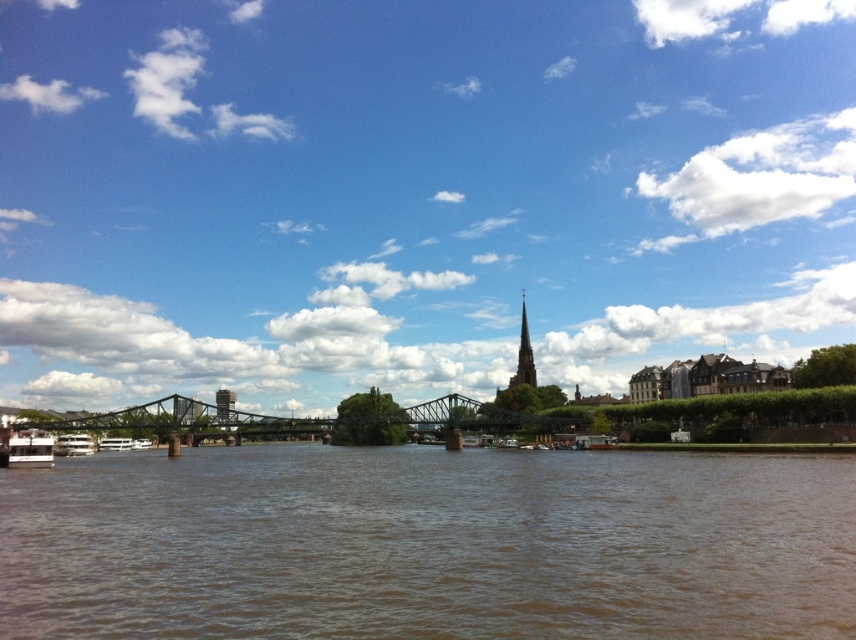
Does blue sky at upper center have a greater height compared to white glossy boat at lower left?

Correct, blue sky at upper center is much taller as white glossy boat at lower left.

Measure the distance between blue sky at upper center and camera.

blue sky at upper center is 466.92 feet away from camera.

Does point (397, 328) come in front of point (28, 444)?

No, it is not.

Locate an element on the screen. Image resolution: width=856 pixels, height=640 pixels. blue sky at upper center is located at coordinates (415, 193).

Which of these two, blue sky at upper center or metallic gray tower at left, stands shorter?

metallic gray tower at left is shorter.

You are a GUI agent. You are given a task and a screenshot of the screen. Output one action in this format:
    pyautogui.click(x=<x>, y=<y>)
    Task: Click on the blue sky at upper center
    The height and width of the screenshot is (640, 856).
    Given the screenshot: What is the action you would take?
    pyautogui.click(x=415, y=193)

Does point (254, 72) come closer to viewer compared to point (229, 419)?

No, (254, 72) is further to viewer.

Where is `blue sky at upper center`? This screenshot has height=640, width=856. blue sky at upper center is located at coordinates (415, 193).

Can you confirm if green stone spire at upper right is positioned above metallic gray tower at left?

Yes.

Can you confirm if green stone spire at upper right is positioned to the right of metallic gray tower at left?

Yes, green stone spire at upper right is to the right of metallic gray tower at left.

Identify the location of green stone spire at upper right. [x=522, y=355].